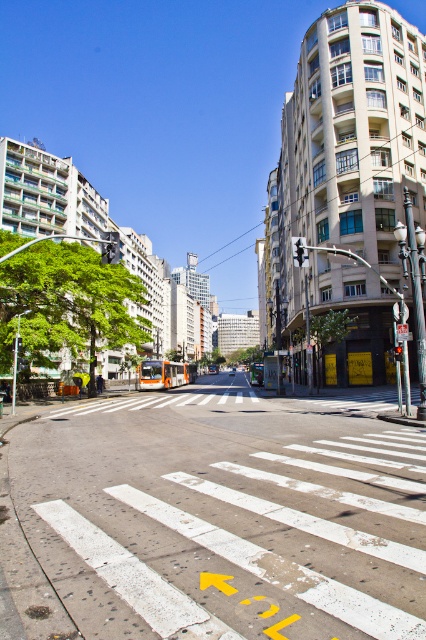
Is point (296, 264) positioned behind point (400, 356)?

Yes, it is behind point (400, 356).

At what (x,y) coordinates should I click in order to perform the action: click on metallic traffic light at center. Please return your answer as a coordinate pair (x, y). The width and height of the screenshot is (426, 640). Looking at the image, I should click on (299, 252).

Which of these two, white painted crosswalk at center or red glass traffic light at center, stands shorter?

With less height is red glass traffic light at center.

What do you see at coordinates (212, 518) in the screenshot? I see `white painted crosswalk at center` at bounding box center [212, 518].

Who is more distant from viewer, (265, 406) or (400, 348)?

The point (265, 406) is behind.

Where is `white painted crosswalk at center`? This screenshot has height=640, width=426. white painted crosswalk at center is located at coordinates (212, 518).

Is the position of white painted crosswalk at center more distant than that of metallic traffic light at center?

No, white painted crosswalk at center is in front of metallic traffic light at center.

Between white painted crosswalk at center and metallic traffic light at center, which one appears on the right side from the viewer's perspective?

From the viewer's perspective, metallic traffic light at center appears more on the right side.

This screenshot has height=640, width=426. Describe the element at coordinates (212, 518) in the screenshot. I see `white painted crosswalk at center` at that location.

Locate an element on the screen. white painted crosswalk at center is located at coordinates point(212,518).